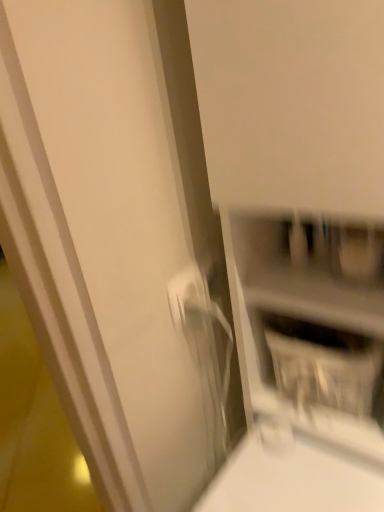
Question: From the image's perspective, is white glossy shelf at center located beneath white glossy electric outlet at center?

Choices:
 (A) no
 (B) yes

Answer: (B)

Question: Does white glossy shelf at center have a greater height compared to white glossy electric outlet at center?

Choices:
 (A) yes
 (B) no

Answer: (A)

Question: From a real-world perspective, does white glossy shelf at center sit lower than white glossy electric outlet at center?

Choices:
 (A) yes
 (B) no

Answer: (A)

Question: Is white glossy shelf at center smaller than white glossy electric outlet at center?

Choices:
 (A) yes
 (B) no

Answer: (B)

Question: Is white glossy shelf at center further to the viewer compared to white glossy electric outlet at center?

Choices:
 (A) no
 (B) yes

Answer: (A)

Question: Is white glossy shelf at center next to white glossy electric outlet at center and touching it?

Choices:
 (A) yes
 (B) no

Answer: (B)

Question: Is white glossy electric outlet at center directly adjacent to white glossy shelf at center?

Choices:
 (A) no
 (B) yes

Answer: (A)

Question: Is white glossy electric outlet at center completely or partially outside of white glossy shelf at center?

Choices:
 (A) no
 (B) yes

Answer: (B)

Question: Does white glossy electric outlet at center have a greater width compared to white glossy shelf at center?

Choices:
 (A) no
 (B) yes

Answer: (A)

Question: From the image's perspective, is white glossy electric outlet at center located beneath white glossy shelf at center?

Choices:
 (A) yes
 (B) no

Answer: (B)

Question: Does white glossy electric outlet at center have a lesser height compared to white glossy shelf at center?

Choices:
 (A) yes
 (B) no

Answer: (A)

Question: Is white glossy electric outlet at center looking in the opposite direction of white glossy shelf at center?

Choices:
 (A) no
 (B) yes

Answer: (A)

Question: Looking at their shapes, would you say white glossy electric outlet at center is wider or thinner than white glossy shelf at center?

Choices:
 (A) wide
 (B) thin

Answer: (B)